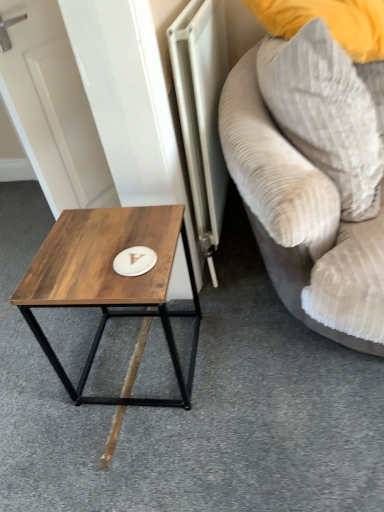
The image size is (384, 512). What do you see at coordinates (202, 111) in the screenshot?
I see `metallic silver radiator at center` at bounding box center [202, 111].

Locate an element on the screen. The height and width of the screenshot is (512, 384). wooden table at left is located at coordinates (109, 283).

Is gray corduroy pillow at upper right not within velvet beige couch at right?

Actually, gray corduroy pillow at upper right is within velvet beige couch at right.

Who is shorter, gray corduroy pillow at upper right or velvet beige couch at right?

With less height is gray corduroy pillow at upper right.

Is point (322, 122) farther from camera compared to point (315, 265)?

No.

Which is more to the right, gray corduroy pillow at upper right or velvet beige couch at right?

velvet beige couch at right.

From a real-world perspective, is wooden table at left beneath metallic silver radiator at center?

Yes, from a real-world perspective, wooden table at left is below metallic silver radiator at center.

Is metallic silver radiator at center a part of wooden table at left?

No, metallic silver radiator at center is not inside wooden table at left.

From the image's perspective, relative to metallic silver radiator at center, is wooden table at left above or below?

Clearly, from the image's perspective, wooden table at left is below metallic silver radiator at center.

Is the position of wooden table at left less distant than that of gray corduroy pillow at upper right?

No, it is not.

Is wooden table at left taller than gray corduroy pillow at upper right?

In fact, wooden table at left may be shorter than gray corduroy pillow at upper right.

Between point (116, 310) and point (308, 138), which one is positioned in front?

The point (308, 138) is more forward.

Is gray corduroy pillow at upper right oriented towards metallic silver radiator at center?

No, gray corduroy pillow at upper right is not facing towards metallic silver radiator at center.

Is gray corduroy pillow at upper right taller or shorter than metallic silver radiator at center?

In the image, gray corduroy pillow at upper right appears to be shorter than metallic silver radiator at center.

Considering the sizes of objects gray corduroy pillow at upper right and metallic silver radiator at center in the image provided, who is smaller, gray corduroy pillow at upper right or metallic silver radiator at center?

metallic silver radiator at center is smaller.

In the image, there is a gray corduroy pillow at upper right. Identify the location of radiator below it (from a real-world perspective). (202, 111).

Does metallic silver radiator at center touch wooden table at left?

metallic silver radiator at center is not next to wooden table at left, and they're not touching.

Considering the positions of point (217, 222) and point (60, 273), is point (217, 222) closer or farther from the camera than point (60, 273)?

Clearly, point (217, 222) is more distant from the camera than point (60, 273).

How much distance is there between metallic silver radiator at center and wooden table at left?

The distance of metallic silver radiator at center from wooden table at left is 14.95 inches.

Can you tell me how much metallic silver radiator at center and wooden table at left differ in facing direction?

The facing directions of metallic silver radiator at center and wooden table at left are 88.5 degrees apart.

Considering the positions of objects metallic silver radiator at center and gray corduroy pillow at upper right in the image provided, who is more to the left, metallic silver radiator at center or gray corduroy pillow at upper right?

From the viewer's perspective, metallic silver radiator at center appears more on the left side.

Is metallic silver radiator at center thinner than gray corduroy pillow at upper right?

Indeed, metallic silver radiator at center has a lesser width compared to gray corduroy pillow at upper right.

Would you say metallic silver radiator at center contains gray corduroy pillow at upper right?

That's incorrect, gray corduroy pillow at upper right is not inside metallic silver radiator at center.

Is velvet beige couch at right wider or thinner than gray corduroy pillow at upper right?

Clearly, velvet beige couch at right has more width compared to gray corduroy pillow at upper right.

Is velvet beige couch at right looking in the opposite direction of gray corduroy pillow at upper right?

Yes.

Which object is further away from the camera taking this photo, velvet beige couch at right or gray corduroy pillow at upper right?

Positioned behind is gray corduroy pillow at upper right.

Where is `pillow lying behind the velvet beige couch at right`? pillow lying behind the velvet beige couch at right is located at coordinates (325, 113).

Locate an element on the screen. table below the metallic silver radiator at center (from the image's perspective) is located at coordinates (109, 283).

Looking at the image, which one is located closer to gray corduroy pillow at upper right, velvet beige couch at right or wooden table at left?

velvet beige couch at right lies closer to gray corduroy pillow at upper right than the other object.

Consider the image. Estimate the real-world distances between objects in this image. Which object is closer to wooden table at left, velvet beige couch at right or gray corduroy pillow at upper right?

velvet beige couch at right.

Based on their spatial positions, is gray corduroy pillow at upper right or metallic silver radiator at center closer to wooden table at left?

Based on the image, metallic silver radiator at center appears to be nearer to wooden table at left.

Considering their positions, is wooden table at left positioned further to metallic silver radiator at center than gray corduroy pillow at upper right?

wooden table at left is further to metallic silver radiator at center.

Based on their spatial positions, is velvet beige couch at right or metallic silver radiator at center further from gray corduroy pillow at upper right?

The object further to gray corduroy pillow at upper right is metallic silver radiator at center.

From the image, which object appears to be nearer to gray corduroy pillow at upper right, metallic silver radiator at center or wooden table at left?

Based on the image, metallic silver radiator at center appears to be nearer to gray corduroy pillow at upper right.

From the image, which object appears to be farther from metallic silver radiator at center, velvet beige couch at right or wooden table at left?

wooden table at left is positioned further to the anchor metallic silver radiator at center.

Looking at the image, which one is located further to gray corduroy pillow at upper right, wooden table at left or metallic silver radiator at center?

wooden table at left.

Identify the location of studio couch between metallic silver radiator at center and wooden table at left in the vertical direction. (302, 221).

At what (x,y) coordinates should I click in order to perform the action: click on pillow positioned between velvet beige couch at right and metallic silver radiator at center from near to far. Please return your answer as a coordinate pair (x, y). Looking at the image, I should click on (325, 113).

Identify the location of pillow between wooden table at left and velvet beige couch at right. (325, 113).

This screenshot has height=512, width=384. What are the coordinates of `pillow between metallic silver radiator at center and wooden table at left in the vertical direction` in the screenshot? It's located at (325, 113).